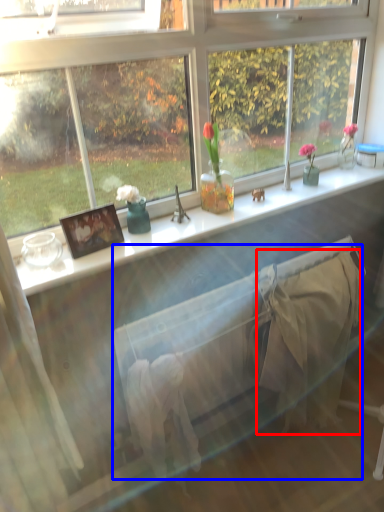
Question: Among these objects, which one is nearest to the camera, blanket (highlighted by a red box) or bed frame (highlighted by a blue box)?

Choices:
 (A) blanket
 (B) bed frame

Answer: (B)